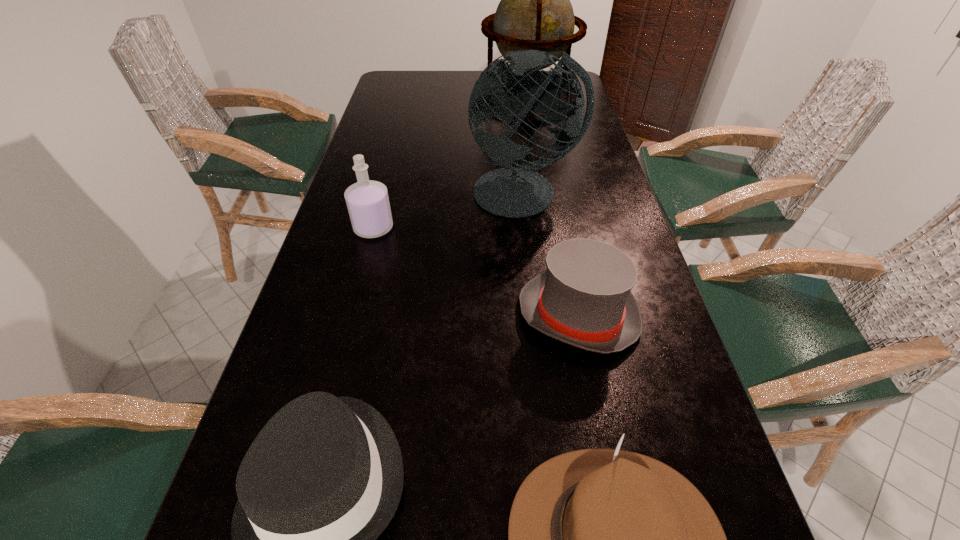
Locate an element on the screen. the farther globe is located at coordinates (535, 13).

At what (x,y) coordinates should I click in order to perform the action: click on the nearer globe. Please return your answer as a coordinate pair (x, y). Image resolution: width=960 pixels, height=540 pixels. Looking at the image, I should click on (515, 190).

You are a GUI agent. You are given a task and a screenshot of the screen. Output one action in this format:
    pyautogui.click(x=<x>, y=<y>)
    Task: Click on the perfume
    This screenshot has width=960, height=540.
    Given the screenshot: What is the action you would take?
    pos(367,201)

What are the coordinates of `the fourth farthest object` in the screenshot? It's located at (583, 298).

Find the location of `free space located on the front-facing side of the farther globe`. free space located on the front-facing side of the farther globe is located at coordinates (544, 191).

Locate an element on the screen. Image resolution: width=960 pixels, height=540 pixels. free space located on the front-facing side of the nearer globe is located at coordinates (538, 307).

At what (x,y) coordinates should I click in order to perform the action: click on free region located 0.330m on the front of the fourth shortest object. Please return your answer as a coordinate pair (x, y). This screenshot has height=540, width=960. Looking at the image, I should click on (340, 356).

Where is `free region located on the left of the third nearest object`? free region located on the left of the third nearest object is located at coordinates (394, 315).

This screenshot has height=540, width=960. Identify the location of object located in the far edge section of the desktop. (535, 13).

Locate an element on the screen. object located in the left edge section of the desktop is located at coordinates (367, 201).